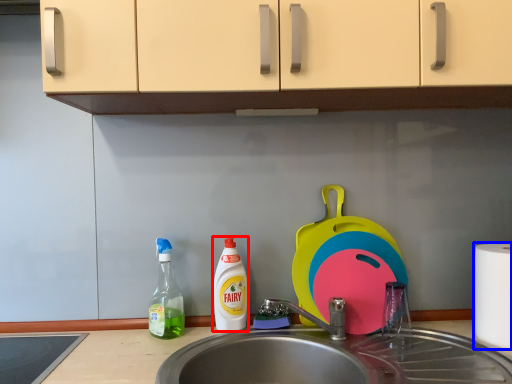
Question: Among these objects, which one is nearest to the camera, cleaning product (highlighted by a red box) or paper towel (highlighted by a blue box)?

Choices:
 (A) cleaning product
 (B) paper towel

Answer: (B)